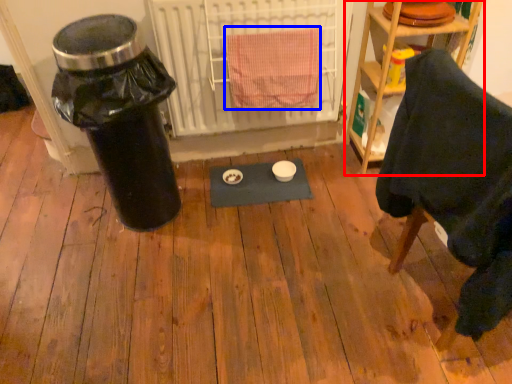
Question: Which object is closer to the camera taking this photo, shelf (highlighted by a red box) or bath towel (highlighted by a blue box)?

Choices:
 (A) shelf
 (B) bath towel

Answer: (B)